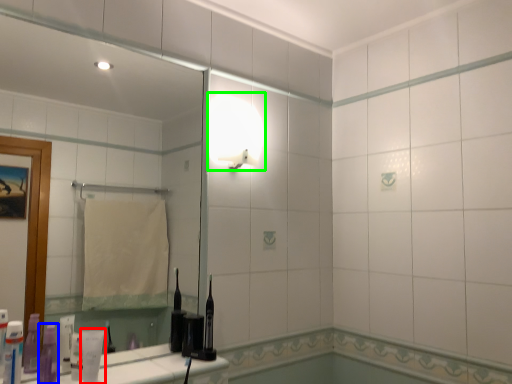
Question: Which object is positioned farthest from toiletry (highlighted by a red box)? Select from toiletry (highlighted by a blue box) and light fixture (highlighted by a green box).

Choices:
 (A) toiletry
 (B) light fixture

Answer: (B)